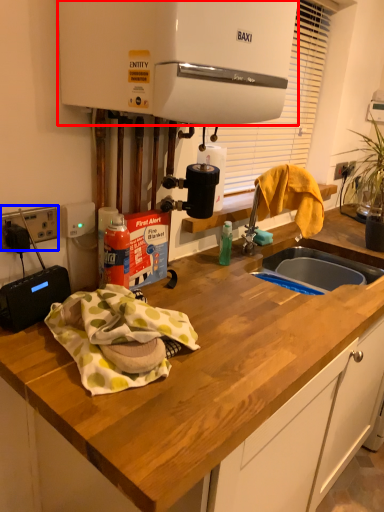
Question: Which object appears farthest to the camera in this image, home appliance (highlighted by a red box) or electric outlet (highlighted by a blue box)?

Choices:
 (A) home appliance
 (B) electric outlet

Answer: (B)